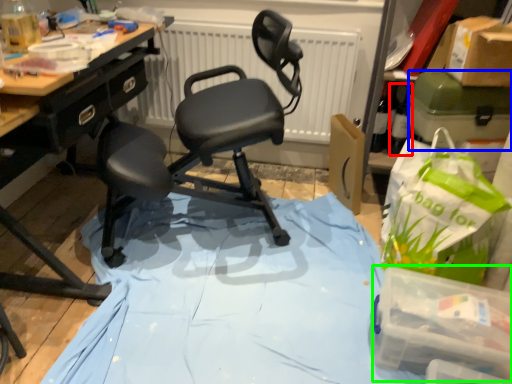
Question: Which is nearer to the bottle (highlighted by a red box)? box (highlighted by a blue box) or box (highlighted by a green box).

Choices:
 (A) box
 (B) box

Answer: (A)